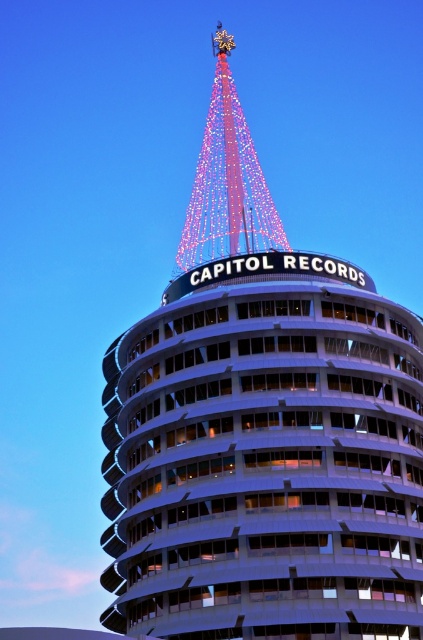
Question: Can you confirm if white glass tower at center is wider than illuminated glass spire at upper center?

Choices:
 (A) yes
 (B) no

Answer: (A)

Question: Among these points, which one is farthest from the camera?

Choices:
 (A) (181, 236)
 (B) (290, 264)

Answer: (A)

Question: Does white glass tower at center have a greater width compared to illuminated glass spire at upper center?

Choices:
 (A) no
 (B) yes

Answer: (B)

Question: Considering the relative positions of white glass tower at center and illuminated glass spire at upper center in the image provided, where is white glass tower at center located with respect to illuminated glass spire at upper center?

Choices:
 (A) below
 (B) above

Answer: (A)